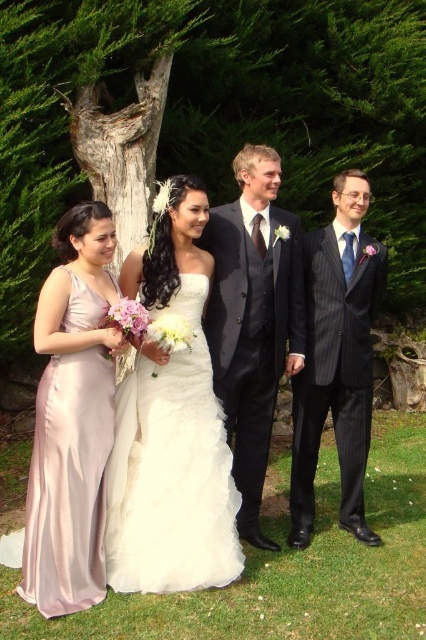
You are a photographer at the wedding and need to position yourself to capture the bride and groom clearly. The dark gray suit at center is the groom. Where should you stand relative to the tree trunk in the background to ensure both the bride and groom are in frame?

To capture both the bride and groom in frame, you should position yourself between the tree trunk and the couple since the dark gray suit at center is located centrally, ensuring both are visible without obstruction.